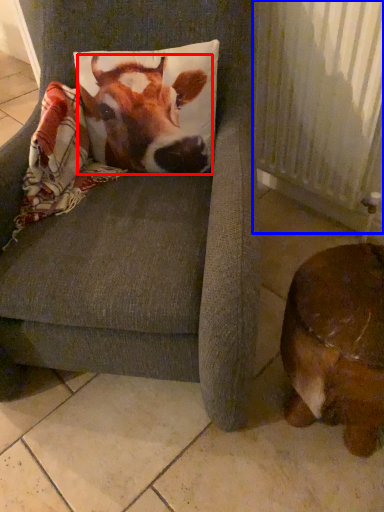
Question: Among these objects, which one is nearest to the camera, cattle (highlighted by a red box) or radiator (highlighted by a blue box)?

Choices:
 (A) cattle
 (B) radiator

Answer: (A)